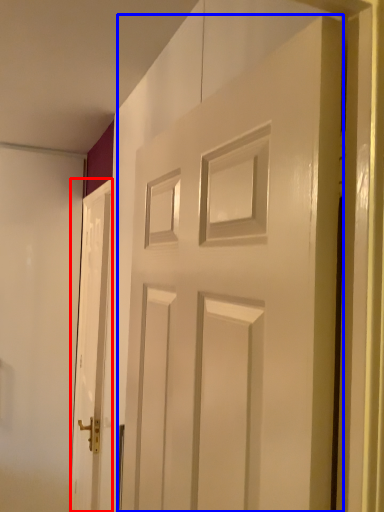
Question: Which object appears closest to the camera in this image, door (highlighted by a red box) or door (highlighted by a blue box)?

Choices:
 (A) door
 (B) door

Answer: (B)